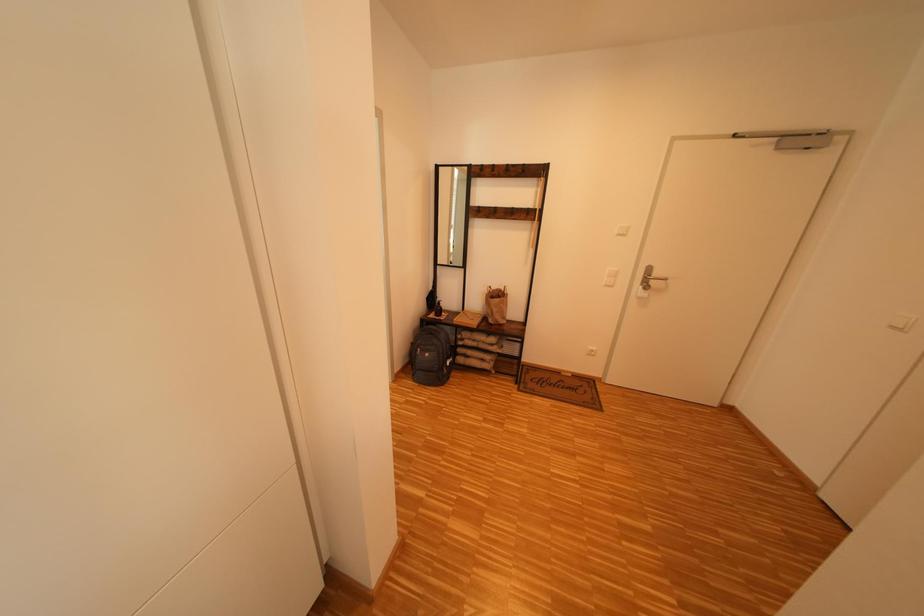
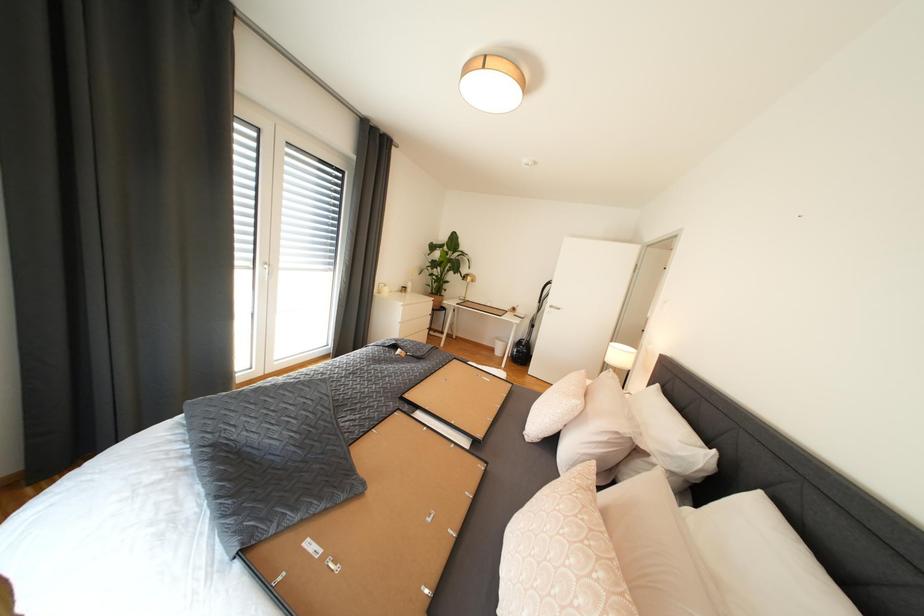
From the picture: In a continuous first-person perspective shot, in which direction is the camera moving?

The cameraman walked toward left, backward.